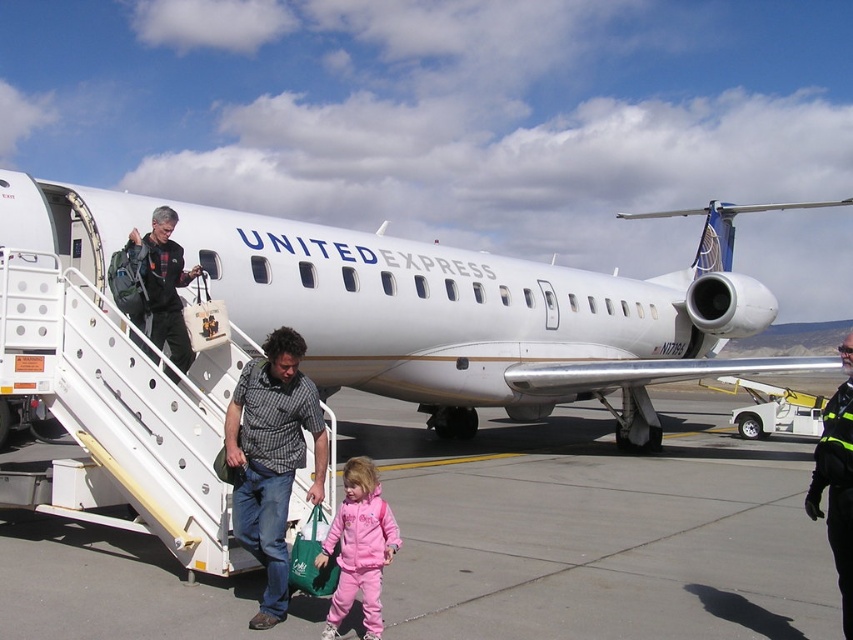
Question: Is pink fleece jacket at lower center positioned behind plaid flannel shirt at upper left?

Choices:
 (A) yes
 (B) no

Answer: (B)

Question: Which point is farther to the camera?

Choices:
 (A) (839, 465)
 (B) (286, 476)

Answer: (B)

Question: Which object is closer to the camera taking this photo?

Choices:
 (A) plaid shirt at center
 (B) black reflective jacket at lower right

Answer: (B)

Question: Based on their relative distances, which object is nearer to the plaid flannel shirt at upper left?

Choices:
 (A) gray concrete tarmac at center
 (B) black reflective jacket at lower right
 (C) white metallic airplane at center
 (D) plaid shirt at center

Answer: (D)

Question: Is plaid shirt at center wider than plaid flannel shirt at upper left?

Choices:
 (A) no
 (B) yes

Answer: (A)

Question: Does white metallic airplane at center have a smaller size compared to plaid shirt at center?

Choices:
 (A) yes
 (B) no

Answer: (B)